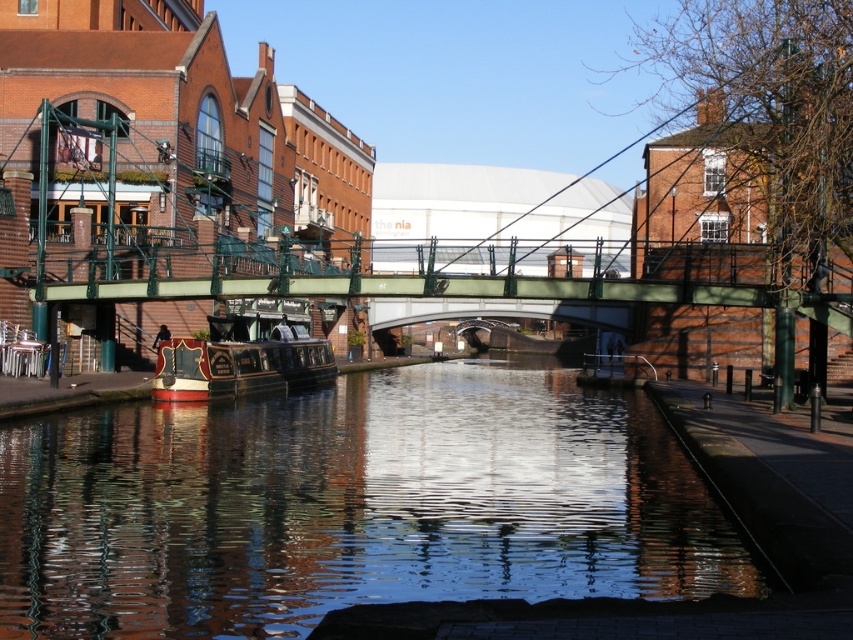
Question: Among these objects, which one is farthest from the camera?

Choices:
 (A) polished wood boat at left
 (B) smooth reflective water at center

Answer: (A)

Question: Is smooth reflective water at center wider than polished wood boat at left?

Choices:
 (A) no
 (B) yes

Answer: (B)

Question: Does smooth reflective water at center appear on the left side of polished wood boat at left?

Choices:
 (A) yes
 (B) no

Answer: (B)

Question: Which object appears closest to the camera in this image?

Choices:
 (A) smooth reflective water at center
 (B) polished wood boat at left

Answer: (A)

Question: Which point appears closest to the camera in this image?

Choices:
 (A) click(x=257, y=307)
 (B) click(x=544, y=522)

Answer: (B)

Question: Can you confirm if smooth reflective water at center is positioned below polished wood boat at left?

Choices:
 (A) yes
 (B) no

Answer: (A)